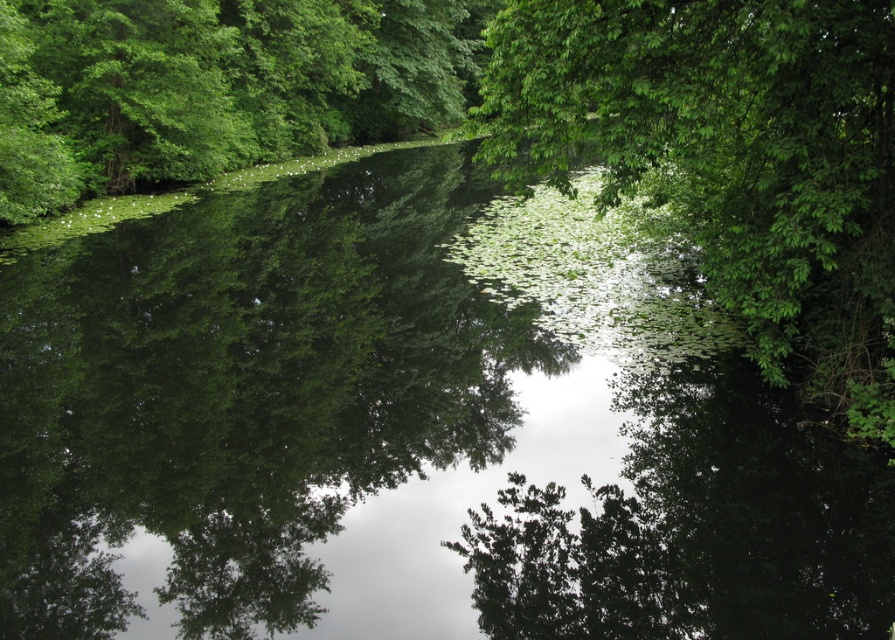
Measure the distance between green leafy tree at upper center and green leafy tree at left.

They are 7.62 meters apart.

Which of these two, green leafy tree at upper center or green leafy tree at left, stands shorter?

Standing shorter between the two is green leafy tree at upper center.

Which is in front, point (791, 300) or point (105, 51)?

Positioned in front is point (791, 300).

You are a GUI agent. You are given a task and a screenshot of the screen. Output one action in this format:
    pyautogui.click(x=<x>, y=<y>)
    Task: Click on the green leafy tree at upper center
    The image size is (895, 640).
    Given the screenshot: What is the action you would take?
    pyautogui.click(x=730, y=160)